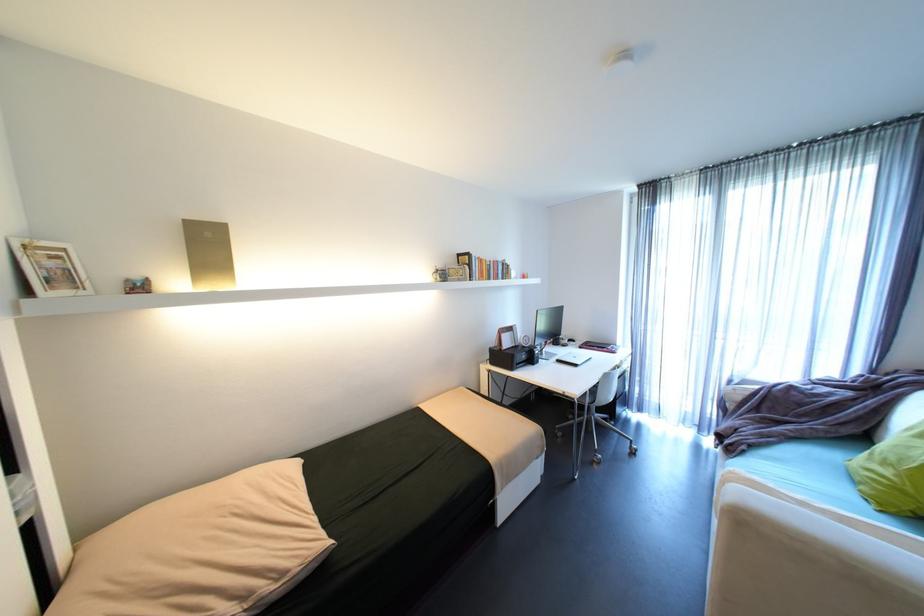
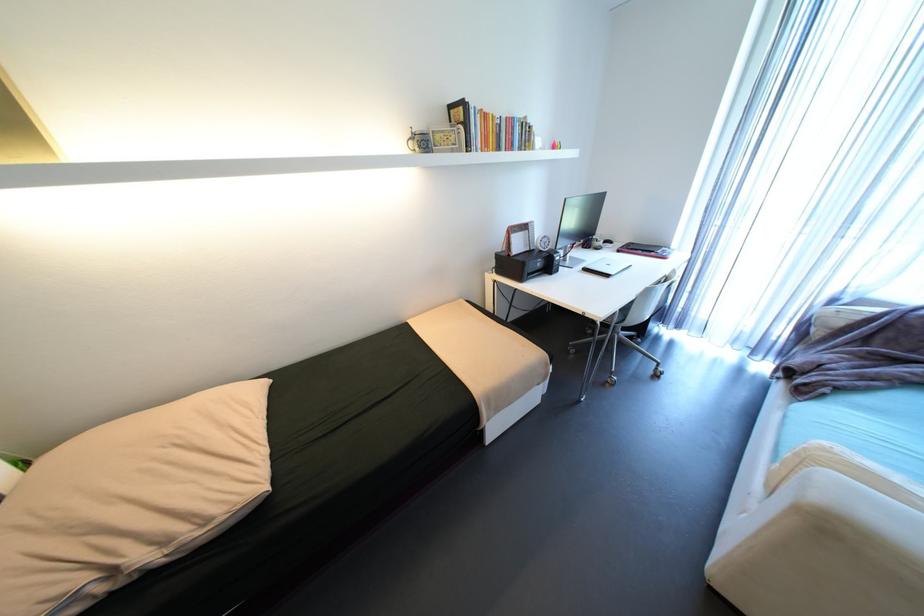
Question: Based on the continuous images, in which direction is the camera rotating? Reply with the corresponding letter.

Choices:
 (A) Left
 (B) Right
 (C) Up
 (D) Down

Answer: (D)